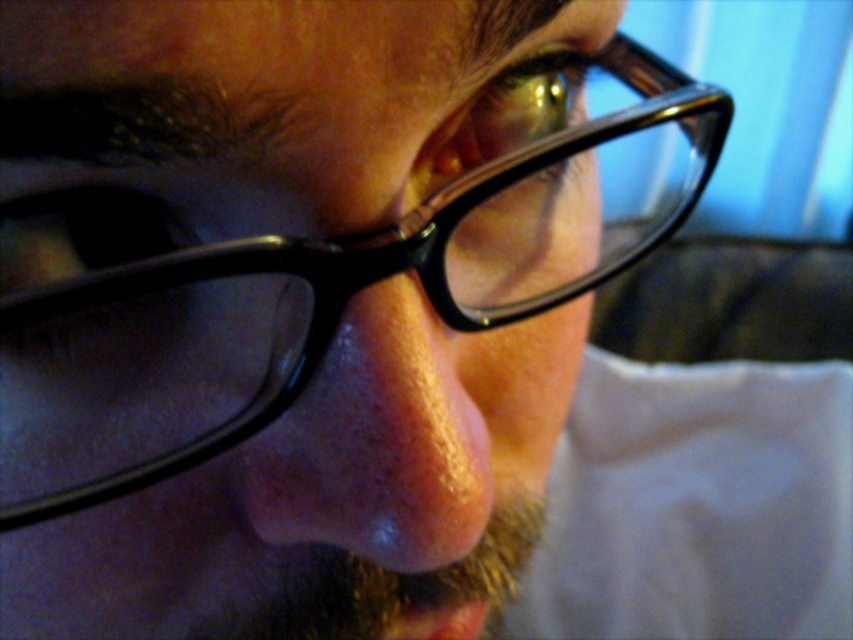
Question: From the image, what is the correct spatial relationship of black plastic glasses at center in relation to pink matte nose at center?

Choices:
 (A) above
 (B) below

Answer: (A)

Question: Considering the relative positions of black plastic glasses at center and pink matte nose at center in the image provided, where is black plastic glasses at center located with respect to pink matte nose at center?

Choices:
 (A) left
 (B) right

Answer: (A)

Question: Which of the following is the closest to the observer?

Choices:
 (A) pink matte nose at center
 (B) black plastic glasses at center

Answer: (B)

Question: Which point is closer to the camera?

Choices:
 (A) (286, 456)
 (B) (317, 145)

Answer: (B)

Question: Is black plastic glasses at center in front of pink matte nose at center?

Choices:
 (A) yes
 (B) no

Answer: (A)